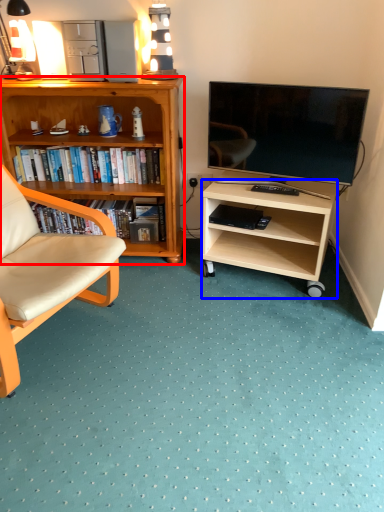
Question: Which object is closer to the camera taking this photo, desk (highlighted by a red box) or desk (highlighted by a blue box)?

Choices:
 (A) desk
 (B) desk

Answer: (B)